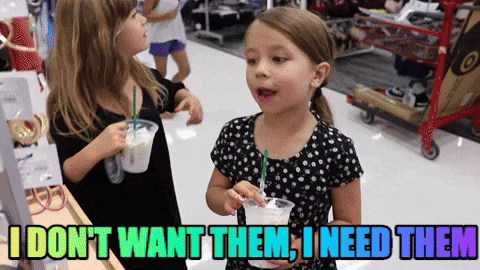
Find the location of a particular element. cardboard box is located at coordinates click(396, 34).